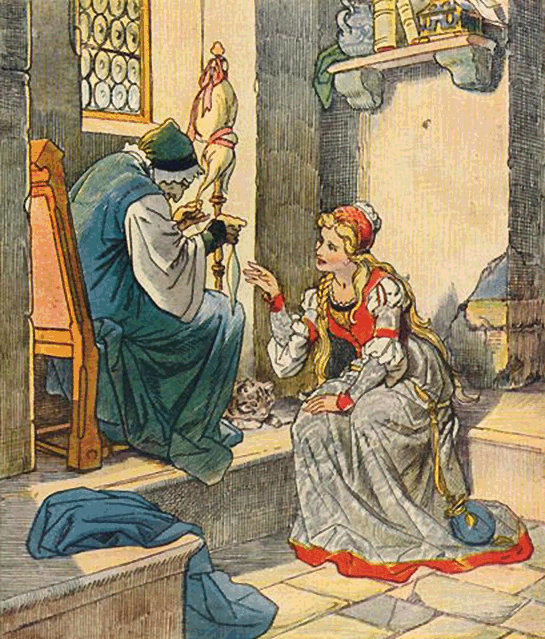
Where is `floor`? floor is located at coordinates (356, 625).